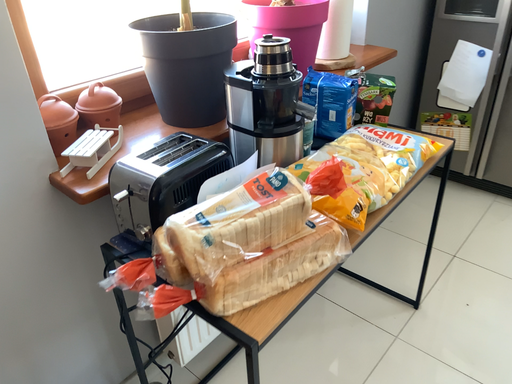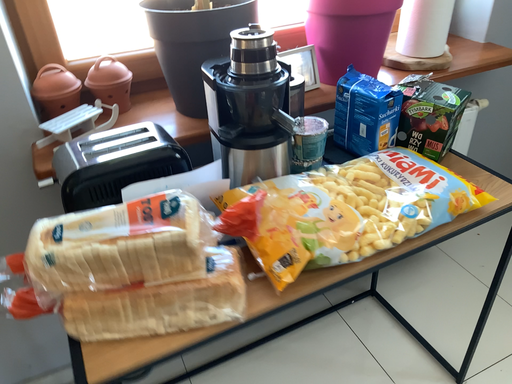
Question: How did the camera likely rotate when shooting the video?

Choices:
 (A) rotated right
 (B) rotated left

Answer: (B)